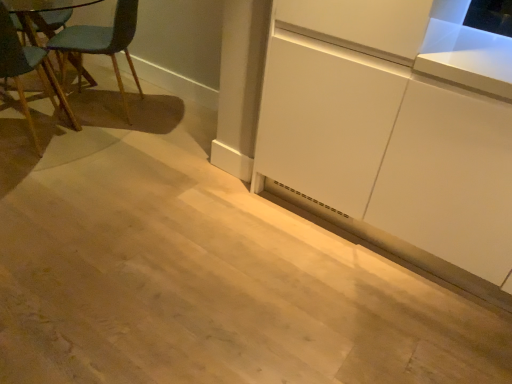
Question: Based on their sizes in the image, would you say white matte cabinet at lower right is bigger or smaller than teal fabric chair at left?

Choices:
 (A) big
 (B) small

Answer: (B)

Question: Visually, is white matte cabinet at lower right positioned to the left or to the right of teal fabric chair at left?

Choices:
 (A) left
 (B) right

Answer: (B)

Question: Considering their positions, is white matte cabinet at lower right located in front of or behind teal fabric chair at left?

Choices:
 (A) front
 (B) behind

Answer: (A)

Question: Considering the positions of point (74, 46) and point (309, 175), is point (74, 46) closer or farther from the camera than point (309, 175)?

Choices:
 (A) farther
 (B) closer

Answer: (A)

Question: Considering the positions of teal fabric chair at left and white matte cabinet at lower right in the image, is teal fabric chair at left wider or thinner than white matte cabinet at lower right?

Choices:
 (A) wide
 (B) thin

Answer: (A)

Question: Based on their sizes in the image, would you say teal fabric chair at left is bigger or smaller than white matte cabinet at lower right?

Choices:
 (A) big
 (B) small

Answer: (A)

Question: Would you say teal fabric chair at left is to the left or to the right of white matte cabinet at lower right in the picture?

Choices:
 (A) right
 (B) left

Answer: (B)